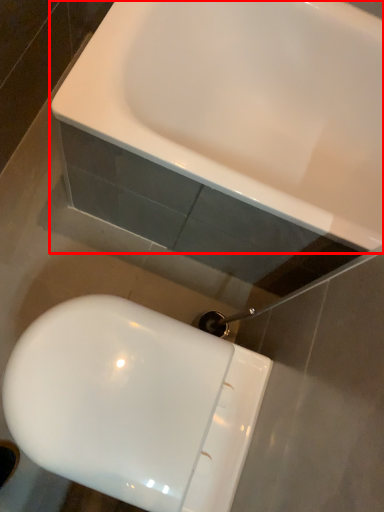
Question: From the image's perspective, where is sink (annotated by the red box) located relative to toilet?

Choices:
 (A) below
 (B) above

Answer: (B)